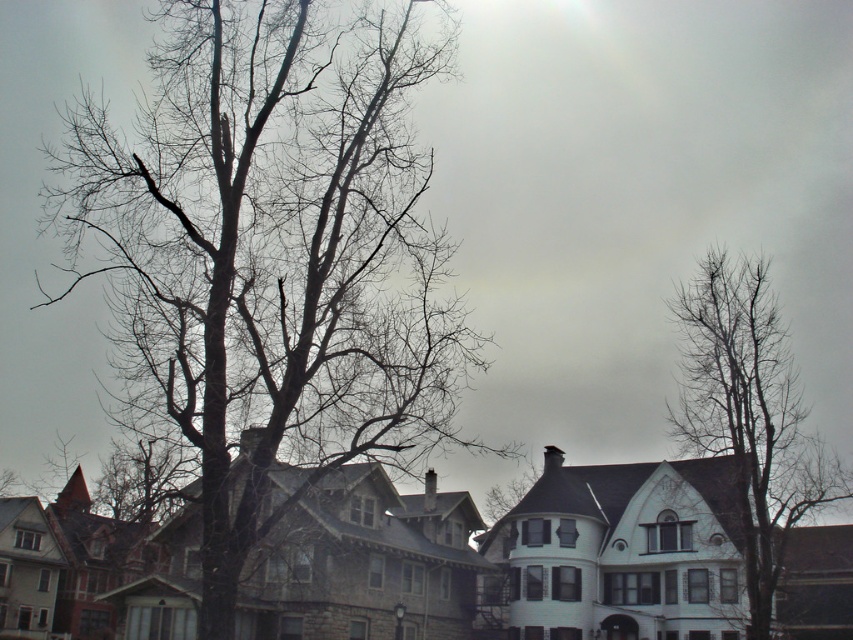
You are standing in the residential area and want to walk from point A to point B. Point A is at coordinates point [312,138] and point B is at coordinates point [769,348]. Since you can only walk through areas that are not obstructed by the tree, will you be able to walk directly from point A to point B without going around the tree?

Point [312,138] is in front of point [769,348], so walking directly from point A to point B would require passing in front of the tree. Since the tree is in the foreground and obstructs the path, you would need to go around it to reach point B without obstruction.

You are standing in the residential area and want to know how far the point marked at coordinates (369, 196) is from your current position. Can you determine the distance?

The point marked at coordinates (369, 196) is 68.36 meters away from your current position.

You are standing in the residential area looking at the two sets of bare branches, the bare branches at left and the bare branches at upper right. Which set of branches appears higher in the image?

The bare branches at left is located above the bare branches at upper right, so the bare branches at left appears higher in the image.